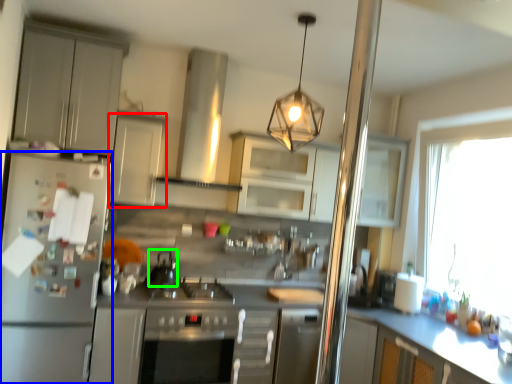
Question: Which object is positioned closest to cabinetry (highlighted by a red box)? Select from kitchen appliance (highlighted by a blue box) and appliance (highlighted by a green box).

Choices:
 (A) kitchen appliance
 (B) appliance

Answer: (A)